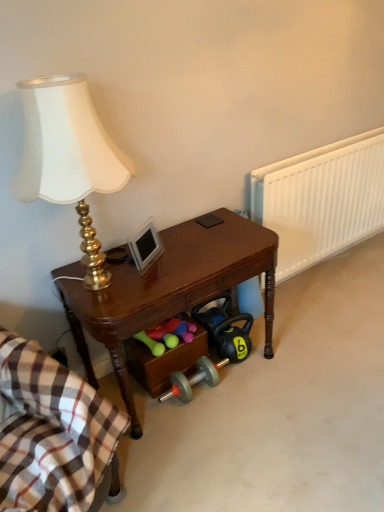
Question: Considering the relative sizes of wooden drawer at lower center and plaid cotton blanket at lower left in the image provided, is wooden drawer at lower center thinner than plaid cotton blanket at lower left?

Choices:
 (A) yes
 (B) no

Answer: (A)

Question: Is wooden drawer at lower center oriented towards plaid cotton blanket at lower left?

Choices:
 (A) yes
 (B) no

Answer: (B)

Question: Does wooden drawer at lower center lie behind plaid cotton blanket at lower left?

Choices:
 (A) no
 (B) yes

Answer: (B)

Question: Is wooden drawer at lower center outside plaid cotton blanket at lower left?

Choices:
 (A) yes
 (B) no

Answer: (A)

Question: Can you confirm if wooden drawer at lower center is bigger than plaid cotton blanket at lower left?

Choices:
 (A) no
 (B) yes

Answer: (A)

Question: Are wooden drawer at lower center and plaid cotton blanket at lower left located far from each other?

Choices:
 (A) no
 (B) yes

Answer: (A)

Question: Is wooden drawer at lower center bigger than white plastic radiator at right?

Choices:
 (A) no
 (B) yes

Answer: (A)

Question: Is wooden drawer at lower center oriented away from white plastic radiator at right?

Choices:
 (A) no
 (B) yes

Answer: (A)

Question: Can you confirm if wooden drawer at lower center is positioned to the right of white plastic radiator at right?

Choices:
 (A) no
 (B) yes

Answer: (A)

Question: Considering the relative sizes of wooden drawer at lower center and white plastic radiator at right in the image provided, is wooden drawer at lower center thinner than white plastic radiator at right?

Choices:
 (A) yes
 (B) no

Answer: (B)

Question: Is wooden drawer at lower center not inside white plastic radiator at right?

Choices:
 (A) no
 (B) yes

Answer: (B)

Question: Is wooden drawer at lower center next to white plastic radiator at right?

Choices:
 (A) yes
 (B) no

Answer: (B)

Question: Is white plastic radiator at right surrounded by plaid cotton blanket at lower left?

Choices:
 (A) yes
 (B) no

Answer: (B)